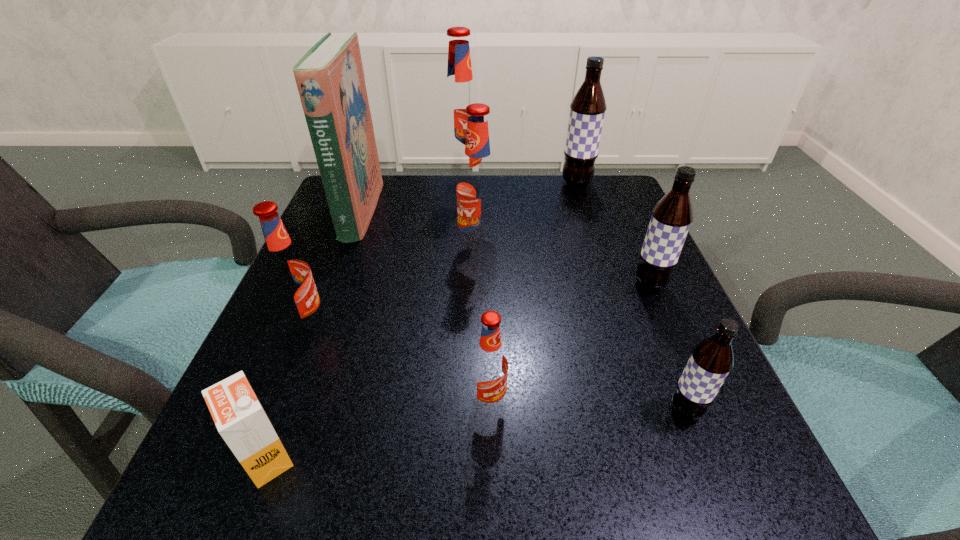
This screenshot has height=540, width=960. Find the location of `free point between the leftmost red root beer and the biggest brown root beer`. free point between the leftmost red root beer and the biggest brown root beer is located at coordinates click(442, 254).

You are a GUI agent. You are given a task and a screenshot of the screen. Output one action in this format:
    pyautogui.click(x=<x>, y=<y>)
    Task: Click on the vacant region between the leftmost root beer and the orange orange juice
    Image resolution: width=960 pixels, height=540 pixels.
    Given the screenshot: What is the action you would take?
    pyautogui.click(x=287, y=391)

Where is `free spot between the third nearest red root beer and the nearest brown root beer`? The width and height of the screenshot is (960, 540). free spot between the third nearest red root beer and the nearest brown root beer is located at coordinates (582, 329).

Identify the location of object that is the fifth nearest to the nearest brown root beer. (288, 274).

Identify the location of object that stands as the sixth closest to the fifth farthest object. (330, 79).

This screenshot has height=540, width=960. I want to click on root beer that can be found as the second closest to the hardback book, so (x=288, y=274).

Find the location of a particular element. This screenshot has width=960, height=540. root beer that is the third closest to the fourth farthest root beer is located at coordinates (587, 110).

Locate which red root beer is the closest to the nearest red root beer. Please provide its 2D coordinates. Your answer should be formatted as a tuple, i.e. [(x, y)], where the tuple contains the x and y coordinates of a point satisfying the conditions above.

[(288, 274)]

Identify the location of red root beer object that ranks as the closest to the farthest red root beer. (478, 189).

Identify which brown root beer is located as the nearest to the farthest brown root beer. Please provide its 2D coordinates. Your answer should be formatted as a tuple, i.e. [(x, y)], where the tuple contains the x and y coordinates of a point satisfying the conditions above.

[(671, 218)]